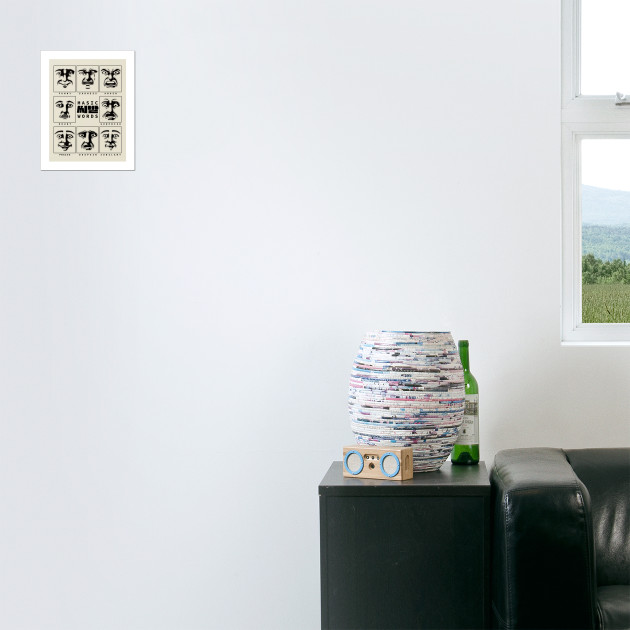
You are a GUI agent. You are given a task and a screenshot of the screen. Output one action in this format:
    pyautogui.click(x=<x>, y=<y>)
    Task: Click on the back cushion of green leather sofa
    
    Given the screenshot: What is the action you would take?
    pyautogui.click(x=622, y=520)